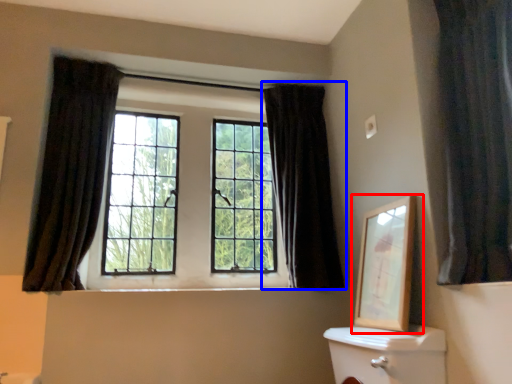
Question: Among these objects, which one is farthest to the camera, picture frame (highlighted by a red box) or curtain (highlighted by a blue box)?

Choices:
 (A) picture frame
 (B) curtain

Answer: (B)